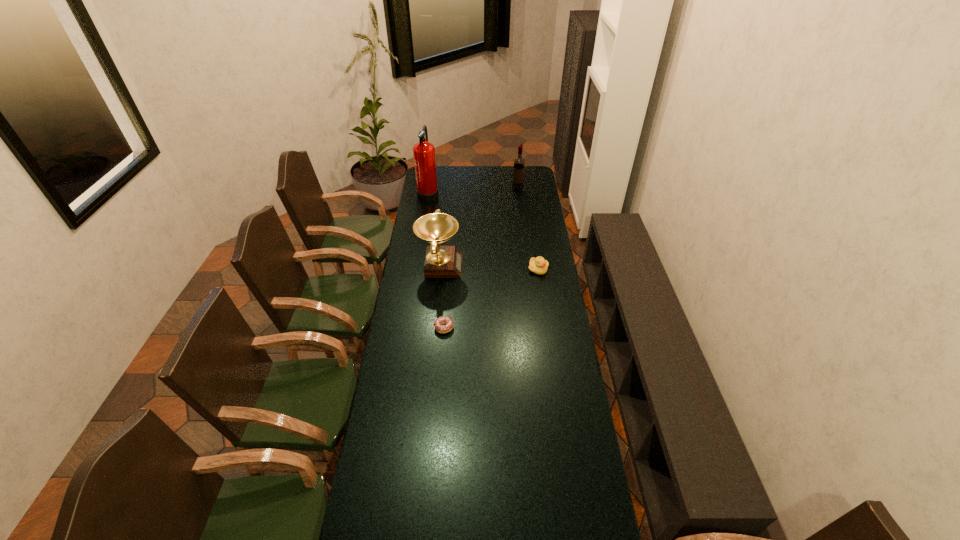
The width and height of the screenshot is (960, 540). Find the location of `fire extinguisher`. fire extinguisher is located at coordinates (423, 152).

This screenshot has height=540, width=960. What are the coordinates of `wine bottle` in the screenshot? It's located at (519, 163).

I want to click on the third tallest object, so [440, 261].

Find the location of `duckling`. duckling is located at coordinates (538, 265).

Locate an element on the screen. The height and width of the screenshot is (540, 960). the nearest object is located at coordinates (440, 328).

What are the coordinates of `the shortest object` in the screenshot? It's located at (440, 328).

In order to click on blank area located on the front of the fire extinguisher in this screenshot , I will do coord(423,222).

At what (x,y) coordinates should I click in order to perform the action: click on free space located on the left of the second tallest object. Please return your answer as a coordinate pair (x, y). This screenshot has height=540, width=960. Looking at the image, I should click on (499, 190).

I want to click on free location located 0.190m on the front-facing side of the award, so click(x=501, y=265).

Locate an element on the screen. free spot located on the beak of the duckling is located at coordinates (542, 298).